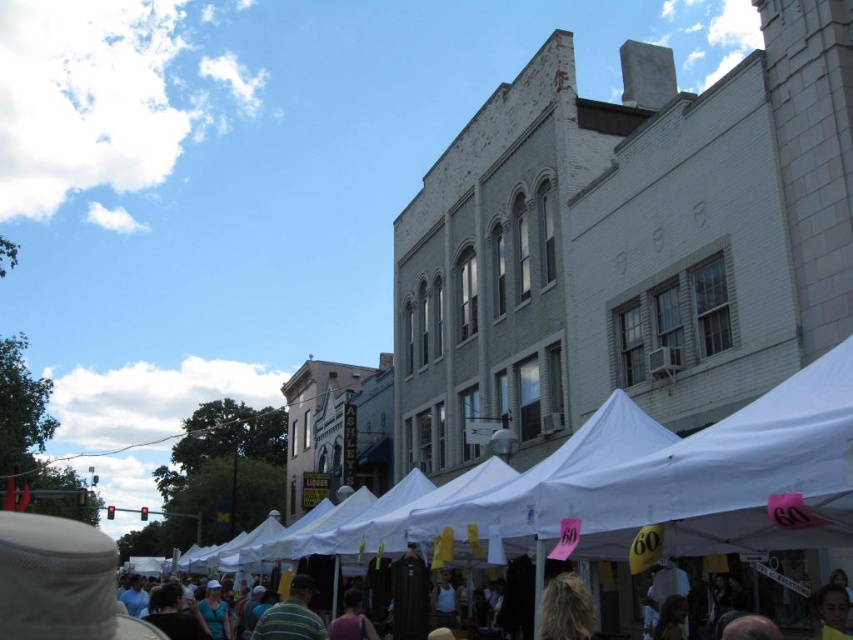
Can you confirm if white fabric tent at center is wider than dark gray fabric crowd at center?

No.

Does white fabric tent at center appear under dark gray fabric crowd at center?

Actually, white fabric tent at center is above dark gray fabric crowd at center.

Which is in front, point (645, 515) or point (814, 602)?

Point (645, 515)

Locate an element on the screen. This screenshot has width=853, height=640. white fabric tent at center is located at coordinates (728, 477).

Is white fabric tent at center to the right of striped fabric at center from the viewer's perspective?

Correct, you'll find white fabric tent at center to the right of striped fabric at center.

What are the coordinates of `white fabric tent at center` in the screenshot? It's located at (728, 477).

Which is in front, point (711, 493) or point (300, 579)?

Positioned in front is point (711, 493).

At what (x,y) coordinates should I click in order to perform the action: click on white fabric tent at center. Please return your answer as a coordinate pair (x, y). This screenshot has width=853, height=640. Looking at the image, I should click on (728, 477).

Who is more forward, (310, 612) or (846, 604)?

Positioned in front is point (846, 604).

The width and height of the screenshot is (853, 640). Identify the location of striped fabric at center. (291, 616).